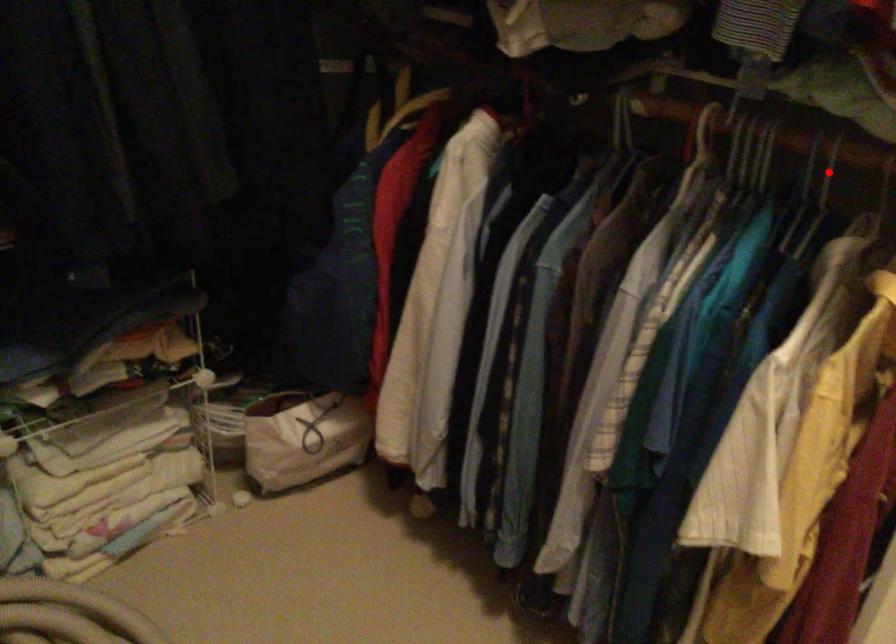
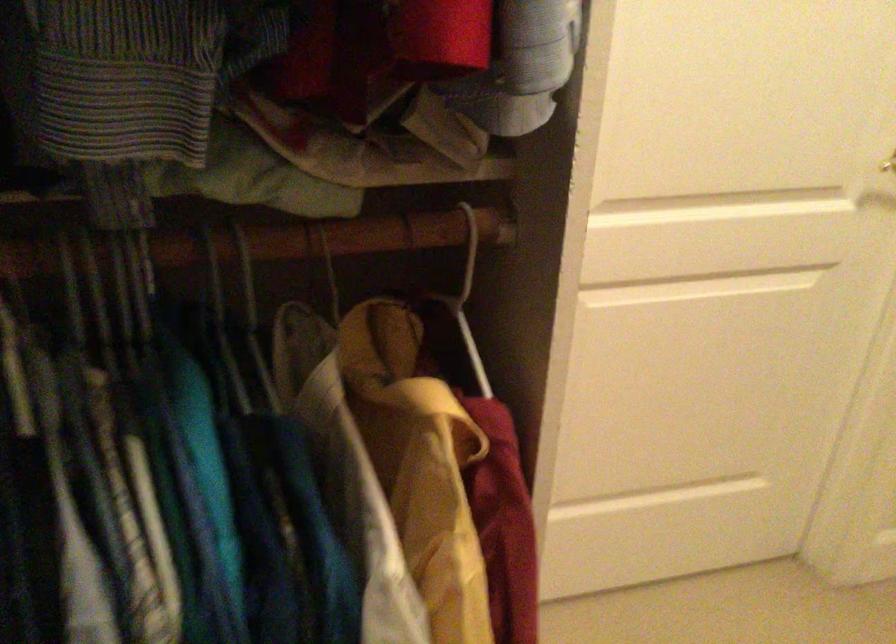
Find the pixel in the second image that matches the highlighted location in the first image.

(135, 245)